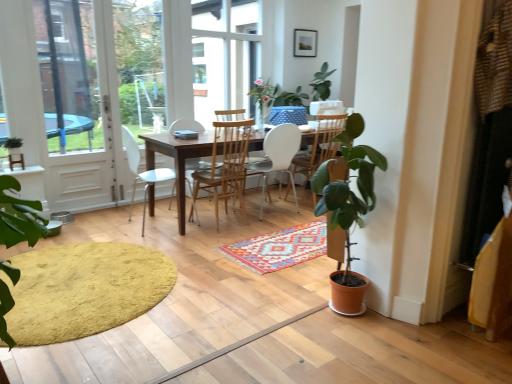
The height and width of the screenshot is (384, 512). Find the location of `vacant space that's between yellow soft rug at lower left, which ranks as the first doormat in left-to-right order, and multicolored woven rug at center, the 1th doormat viewed from the right`. vacant space that's between yellow soft rug at lower left, which ranks as the first doormat in left-to-right order, and multicolored woven rug at center, the 1th doormat viewed from the right is located at coordinates (210, 240).